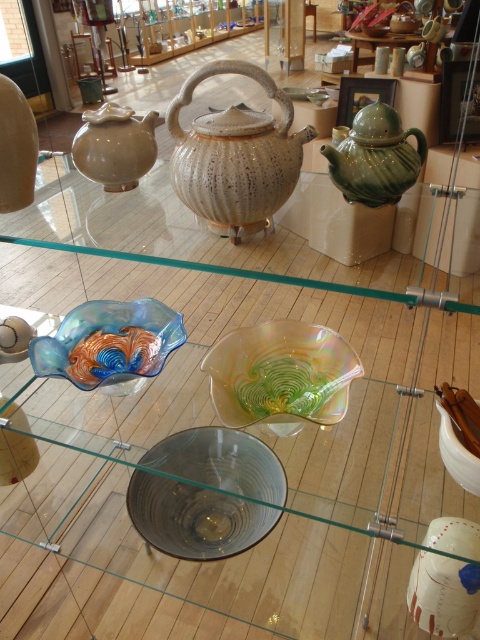
Question: Does translucent iridescent bowl at center appear over green glazed teapot at upper right?

Choices:
 (A) no
 (B) yes

Answer: (A)

Question: Is green glazed teapot at upper right thinner than translucent glass bowl at center?

Choices:
 (A) yes
 (B) no

Answer: (B)

Question: Which object appears farthest from the camera in this image?

Choices:
 (A) translucent glass bowl at center
 (B) matte white bowl at lower right
 (C) speckled ceramic teapot at center
 (D) translucent iridescent bowl at center

Answer: (A)

Question: Does speckled ceramic teapot at center appear under matte beige teapot at upper left?

Choices:
 (A) no
 (B) yes

Answer: (B)

Question: Among these objects, which one is nearest to the camera?

Choices:
 (A) transparent glass bowl at center
 (B) green glazed teapot at upper right
 (C) translucent glass bowl at center
 (D) matte white bowl at lower right

Answer: (D)

Question: Which point appears closest to the camera in this image?

Choices:
 (A) (352, 164)
 (B) (171, 493)
 (C) (95, 125)
 (D) (285, 376)

Answer: (A)